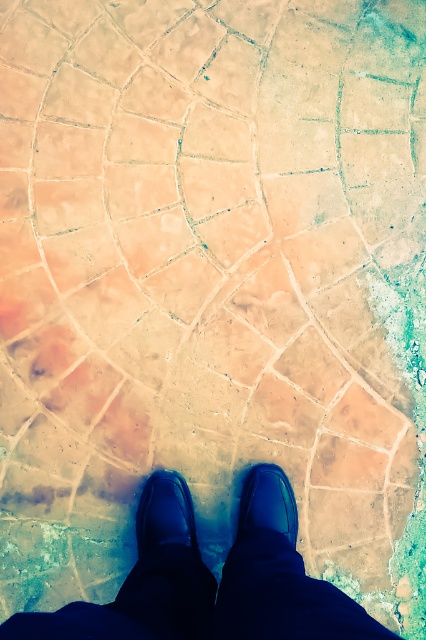
Question: Which object is positioned farthest from the shiny black shoe at center?

Choices:
 (A) black leather shoes at center
 (B) matte black shoe at center

Answer: (A)

Question: Observing the image, what is the correct spatial positioning of black leather shoes at center in reference to matte black shoe at center?

Choices:
 (A) left
 (B) right

Answer: (A)

Question: Which object appears closest to the camera in this image?

Choices:
 (A) shiny black shoe at center
 (B) matte black shoe at center

Answer: (A)

Question: Does black leather shoes at center have a greater width compared to shiny black shoe at center?

Choices:
 (A) yes
 (B) no

Answer: (A)

Question: Which point appears farthest from the camera in this image?

Choices:
 (A) (259, 496)
 (B) (293, 618)
 (C) (180, 500)

Answer: (C)

Question: Can you confirm if black leather shoes at center is positioned to the left of matte black shoe at center?

Choices:
 (A) no
 (B) yes

Answer: (B)